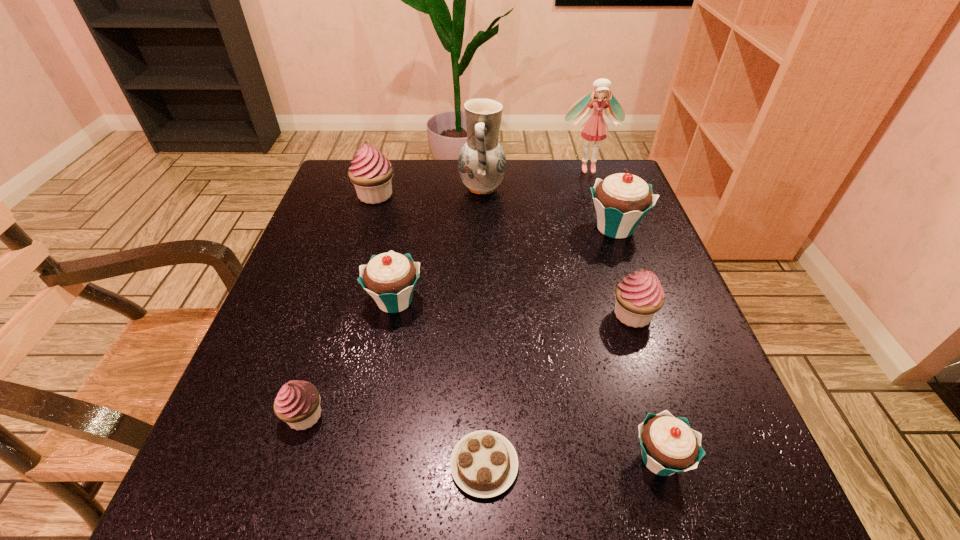
You are a GUI agent. You are given a task and a screenshot of the screen. Output one action in this format:
    pyautogui.click(x=<x>, y=<y>)
    Task: Click on the nearest pink cupcake
    The width and height of the screenshot is (960, 540).
    Given the screenshot: What is the action you would take?
    pyautogui.click(x=297, y=403)

Locate an element on the screen. the smallest teal cupcake is located at coordinates pyautogui.click(x=669, y=445).

At what (x,y) coordinates should I click in order to perform the action: click on chocolate cake. Please return your answer as a coordinate pair (x, y). The image size is (960, 540). Looking at the image, I should click on (484, 464).

Image resolution: width=960 pixels, height=540 pixels. Find the location of `free location located 0.360m on the front-facing side of the pink doll`. free location located 0.360m on the front-facing side of the pink doll is located at coordinates (619, 263).

The image size is (960, 540). I want to click on free space located 0.140m on either side of the pottery, so click(x=406, y=188).

At what (x,y) coordinates should I click in order to perform the action: click on free space located 0.210m on either side of the pottery. Please return your answer as a coordinate pair (x, y). The height and width of the screenshot is (540, 960). Looking at the image, I should click on (379, 188).

This screenshot has width=960, height=540. Identify the location of free space located 0.070m on either side of the pottery. (433, 188).

Identify the location of vacant region located on the right of the farthest pink cupcake. (490, 195).

Where is `free space located 0.210m on the front of the second farthest cupcake`? The width and height of the screenshot is (960, 540). free space located 0.210m on the front of the second farthest cupcake is located at coordinates (648, 320).

What are the coordinates of `free space located 0.310m on the front of the second smallest teal cupcake` in the screenshot? It's located at (357, 497).